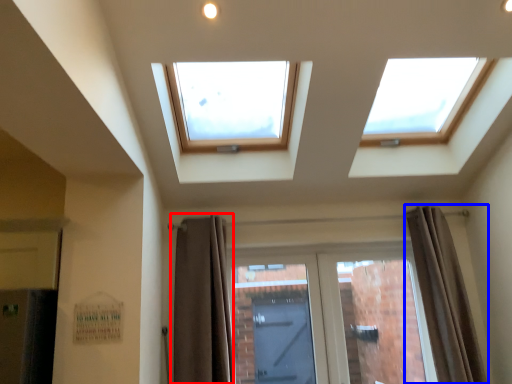
Question: Which of the following is the closest to the observer, curtain (highlighted by a red box) or curtain (highlighted by a blue box)?

Choices:
 (A) curtain
 (B) curtain

Answer: (A)